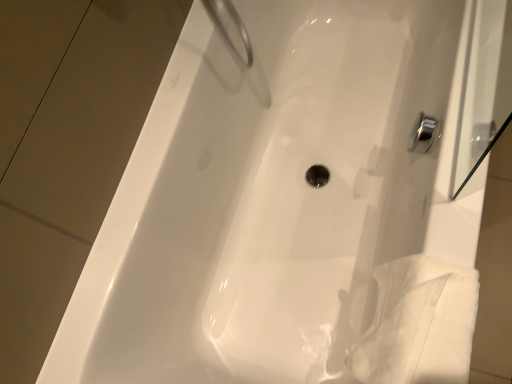
Measure the distance between white fabric towel at lower right and camera.

The depth of white fabric towel at lower right is 27.48 inches.

Image resolution: width=512 pixels, height=384 pixels. Find the location of `white fabric towel at lower right`. white fabric towel at lower right is located at coordinates (418, 324).

This screenshot has width=512, height=384. Describe the element at coordinates (418, 324) in the screenshot. I see `white fabric towel at lower right` at that location.

The height and width of the screenshot is (384, 512). What are the coordinates of `white fabric towel at lower right` in the screenshot? It's located at (418, 324).